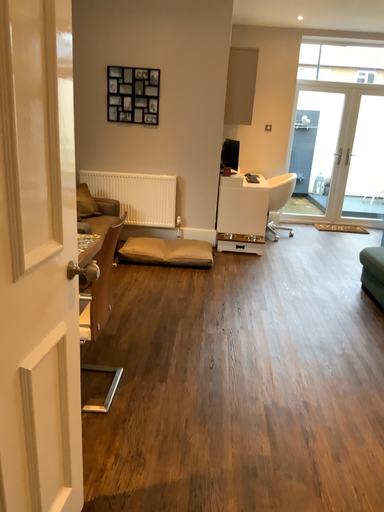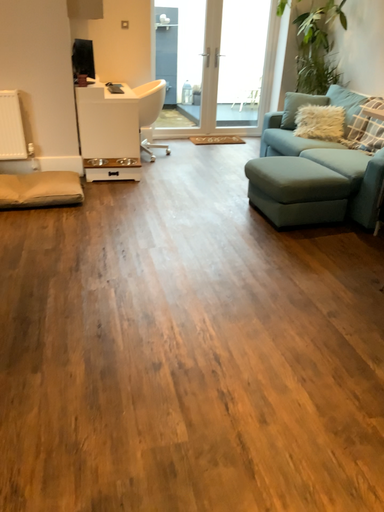
Question: How did the camera likely rotate when shooting the video?

Choices:
 (A) rotated left
 (B) rotated right

Answer: (B)